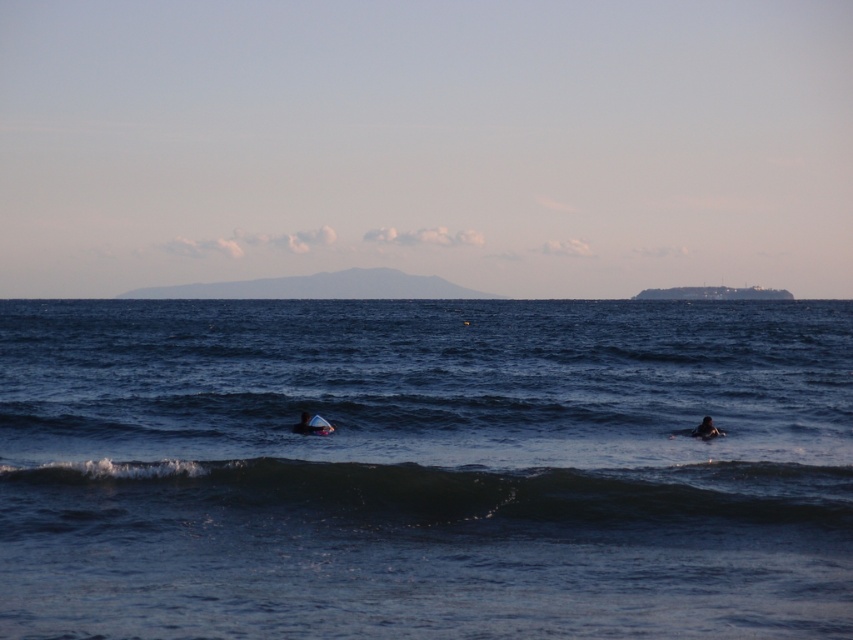
Does white foam surfboard at center appear on the right side of white foam surfboard at lower right?

Incorrect, white foam surfboard at center is not on the right side of white foam surfboard at lower right.

Locate an element on the screen. This screenshot has width=853, height=640. white foam surfboard at center is located at coordinates [x=318, y=426].

This screenshot has height=640, width=853. I want to click on white foam surfboard at center, so (x=318, y=426).

Locate an element on the screen. white foam surfboard at center is located at coordinates (318, 426).

Who is lower down, white foam surfboard at center or dark blue wetsuit at lower right?

dark blue wetsuit at lower right is below.

Is white foam surfboard at center closer to the viewer compared to dark blue wetsuit at lower right?

No, white foam surfboard at center is behind dark blue wetsuit at lower right.

I want to click on white foam surfboard at center, so click(x=318, y=426).

You are a GUI agent. You are given a task and a screenshot of the screen. Output one action in this format:
    pyautogui.click(x=<x>, y=<y>)
    Task: Click on the white foam surfboard at center
    
    Given the screenshot: What is the action you would take?
    tap(318, 426)

Is blue water at center smaller than white foam surfboard at center?

Actually, blue water at center might be larger than white foam surfboard at center.

Who is higher up, blue water at center or white foam surfboard at center?

blue water at center is above.

Which is behind, point (270, 493) or point (316, 428)?

Positioned behind is point (316, 428).

Find the location of a particular element. Image resolution: width=853 pixels, height=640 pixels. blue water at center is located at coordinates (424, 468).